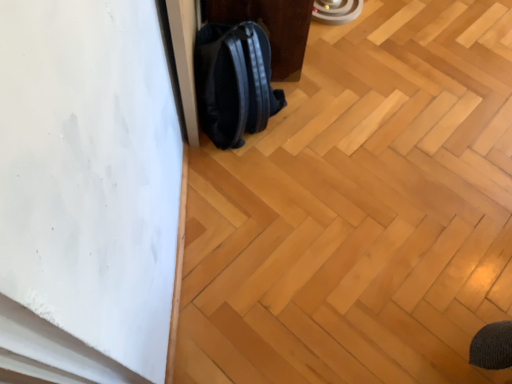
Where is `unoccupied region to the right of black leather backpack at lower left`? Image resolution: width=512 pixels, height=384 pixels. unoccupied region to the right of black leather backpack at lower left is located at coordinates (345, 60).